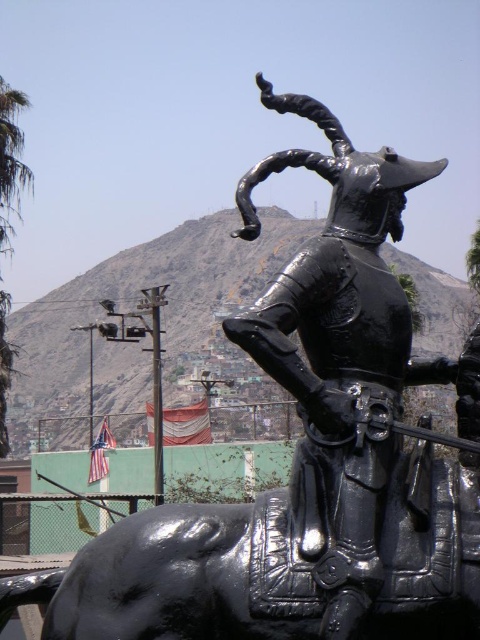
Who is shorter, glossy black armor at center or green leafy palm tree at left?

glossy black armor at center

Can you confirm if glossy black armor at center is smaller than green leafy palm tree at left?

Yes.

You are a GUI agent. You are given a task and a screenshot of the screen. Output one action in this format:
    pyautogui.click(x=<x>, y=<y>)
    Task: Click on the glossy black armor at center
    The height and width of the screenshot is (640, 480).
    Given the screenshot: What is the action you would take?
    pyautogui.click(x=337, y=352)